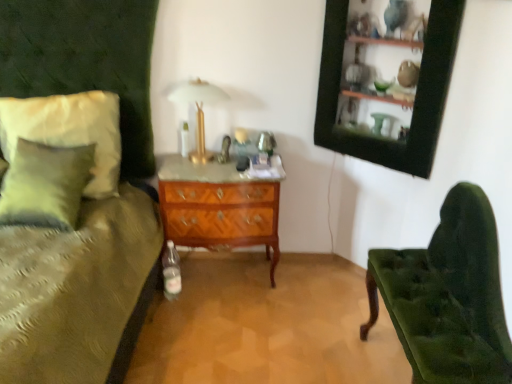
Question: From a real-world perspective, is gold metallic table lamp at upper center positioned under soft white fabric pillow at left based on gravity?

Choices:
 (A) no
 (B) yes

Answer: (A)

Question: Is gold metallic table lamp at upper center smaller than soft white fabric pillow at left?

Choices:
 (A) no
 (B) yes

Answer: (B)

Question: Can you confirm if gold metallic table lamp at upper center is wider than soft white fabric pillow at left?

Choices:
 (A) no
 (B) yes

Answer: (A)

Question: Considering the relative positions of gold metallic table lamp at upper center and soft white fabric pillow at left in the image provided, is gold metallic table lamp at upper center to the left of soft white fabric pillow at left from the viewer's perspective?

Choices:
 (A) no
 (B) yes

Answer: (A)

Question: Does gold metallic table lamp at upper center lie in front of soft white fabric pillow at left?

Choices:
 (A) yes
 (B) no

Answer: (B)

Question: Considering the positions of velvet green chair at right and soft white fabric pillow at left in the image, is velvet green chair at right taller or shorter than soft white fabric pillow at left?

Choices:
 (A) tall
 (B) short

Answer: (A)

Question: Does point (486, 372) appear closer or farther from the camera than point (117, 145)?

Choices:
 (A) farther
 (B) closer

Answer: (B)

Question: Is velvet green chair at right inside the boundaries of soft white fabric pillow at left, or outside?

Choices:
 (A) outside
 (B) inside

Answer: (A)

Question: From a real-world perspective, is velvet green chair at right above or below soft white fabric pillow at left?

Choices:
 (A) above
 (B) below

Answer: (B)

Question: In the image, is soft white fabric pillow at left positioned in front of or behind gold metallic table lamp at upper center?

Choices:
 (A) front
 (B) behind

Answer: (A)

Question: From a real-world perspective, is soft white fabric pillow at left above or below gold metallic table lamp at upper center?

Choices:
 (A) above
 (B) below

Answer: (B)

Question: Considering the positions of soft white fabric pillow at left and gold metallic table lamp at upper center in the image, is soft white fabric pillow at left taller or shorter than gold metallic table lamp at upper center?

Choices:
 (A) tall
 (B) short

Answer: (A)

Question: Is point (60, 142) closer or farther from the camera than point (211, 152)?

Choices:
 (A) closer
 (B) farther

Answer: (A)

Question: Is gold metallic table lamp at upper center situated inside black wood picture frame at upper right or outside?

Choices:
 (A) inside
 (B) outside

Answer: (B)

Question: In the image, is gold metallic table lamp at upper center on the left side or the right side of black wood picture frame at upper right?

Choices:
 (A) left
 (B) right

Answer: (A)